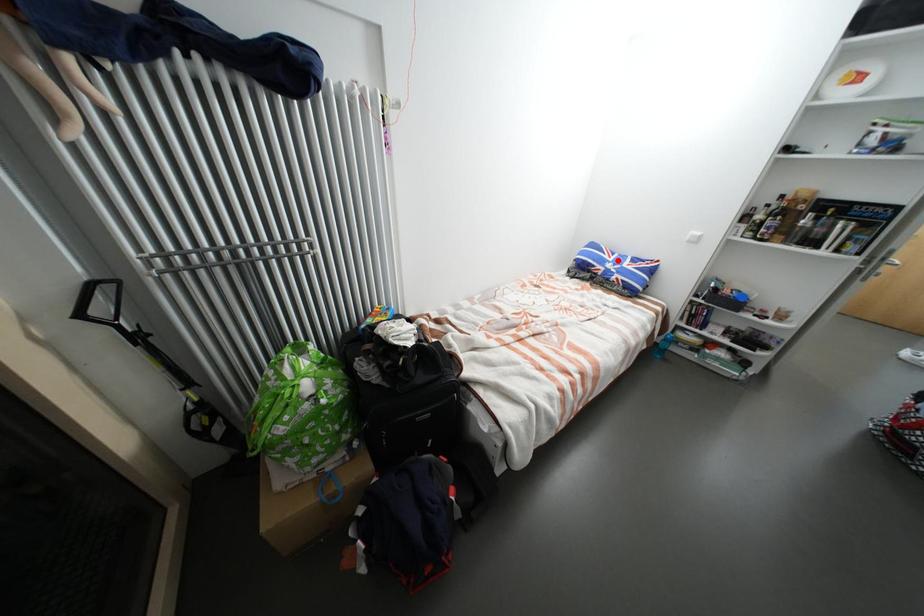
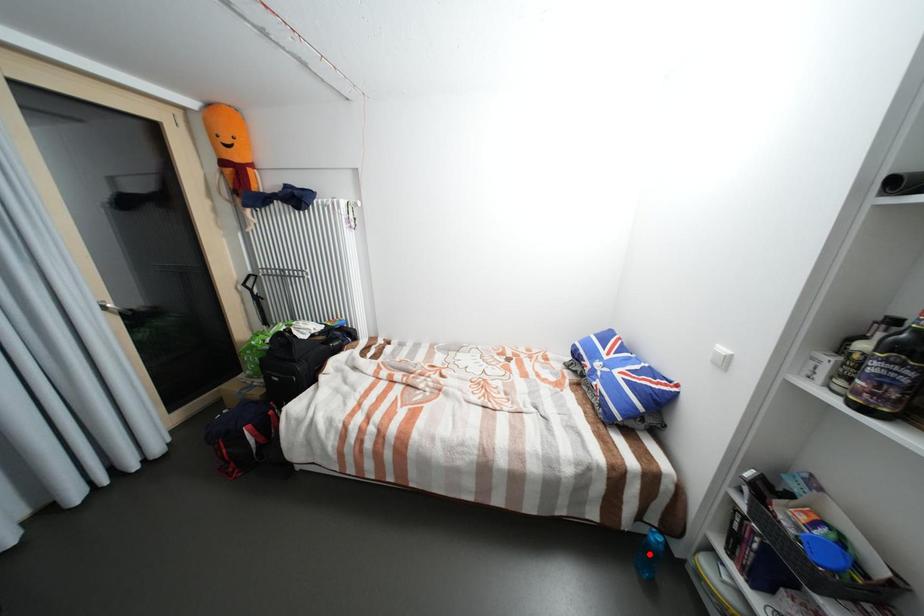
I am providing you with two images of the same scene from different viewpoints. A red point is marked on the first image and another point is marked on the second image. Does the point marked in image1 correspond to the same location as the one in image2?

No